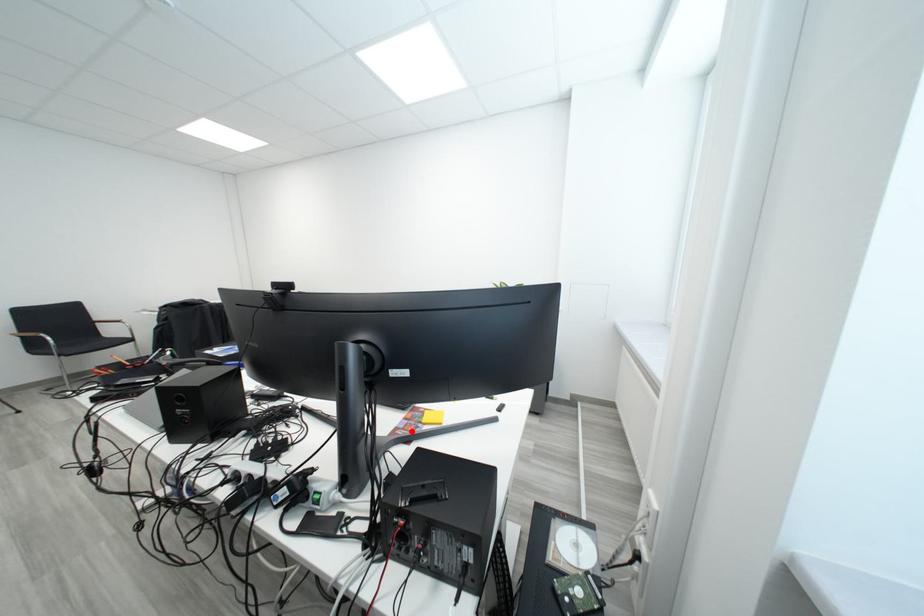
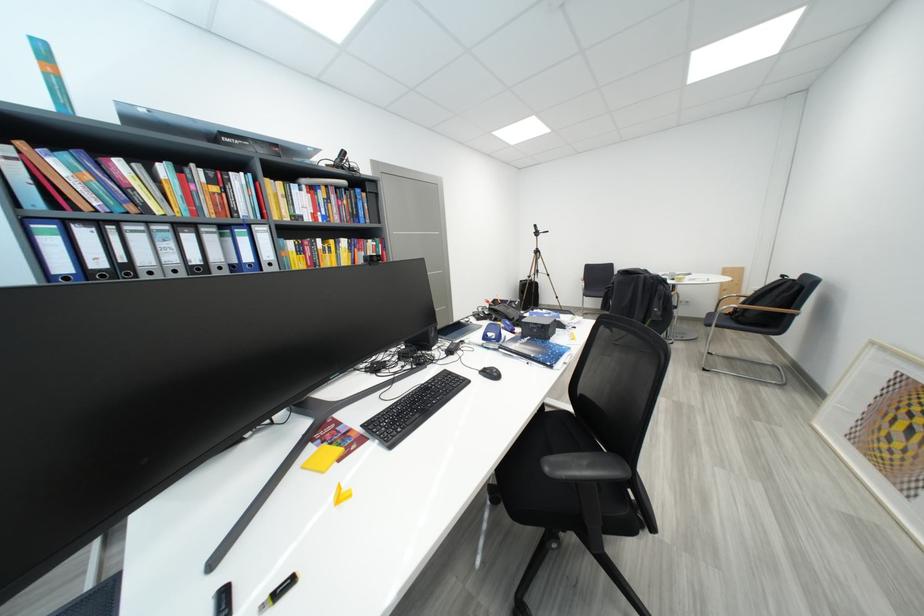
Where in the second image is the point corresponding to the highlighted location from the first image?

(343, 432)